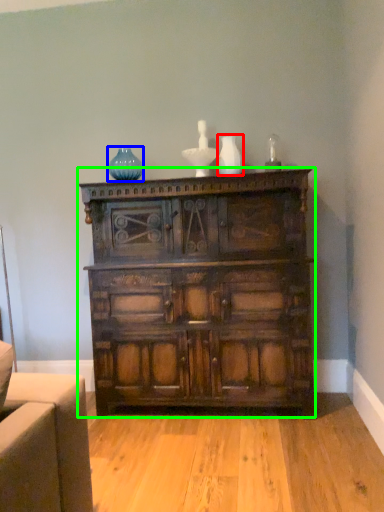
Question: Which object is positioned farthest from vase (highlighted by a red box)? Select from glass vase (highlighted by a blue box) and chest of drawers (highlighted by a green box).

Choices:
 (A) glass vase
 (B) chest of drawers

Answer: (B)